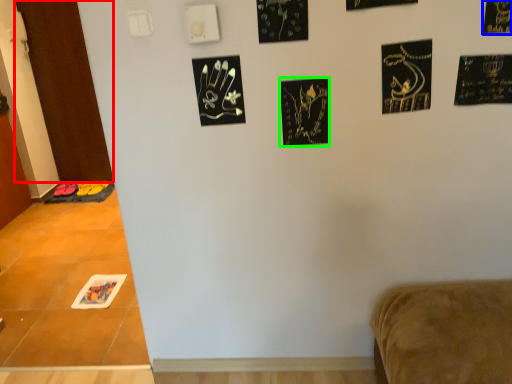
Question: Which object is the farthest from door (highlighted by a red box)? Choose among these: print (highlighted by a blue box) or print (highlighted by a green box).

Choices:
 (A) print
 (B) print

Answer: (A)